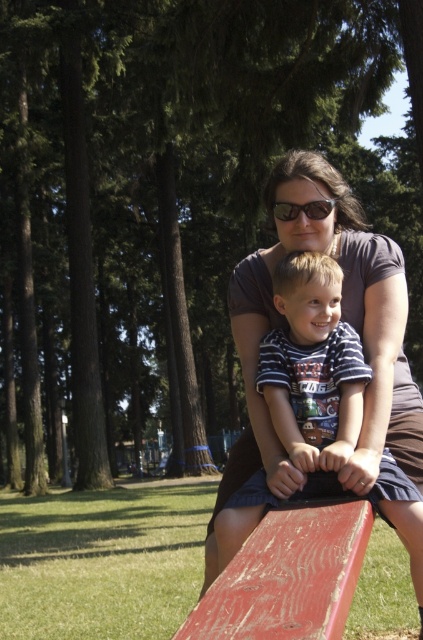
Question: Based on their relative distances, which object is nearer to the matte black sunglasses at center?

Choices:
 (A) matte brown shirt at center
 (B) striped cotton shirt at center

Answer: (A)

Question: Can you confirm if striped cotton shirt at center is positioned above matte black sunglasses at center?

Choices:
 (A) yes
 (B) no

Answer: (B)

Question: Is matte brown shirt at center thinner than striped cotton shirt at center?

Choices:
 (A) yes
 (B) no

Answer: (A)

Question: In this image, where is matte brown shirt at center located relative to matte black sunglasses at center?

Choices:
 (A) left
 (B) right

Answer: (A)

Question: Which object appears farthest from the camera in this image?

Choices:
 (A) striped cotton shirt at center
 (B) matte brown shirt at center

Answer: (B)

Question: Which object appears farthest from the camera in this image?

Choices:
 (A) matte black sunglasses at center
 (B) matte brown shirt at center

Answer: (B)